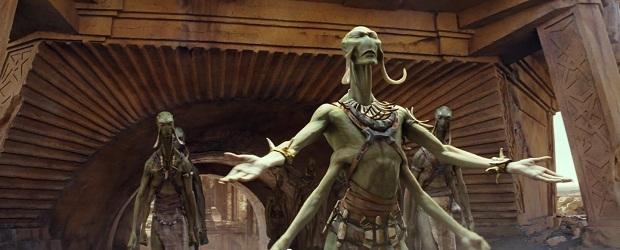
Locate an element on the screen. This screenshot has height=250, width=620. brown stone wall is located at coordinates (257, 9).